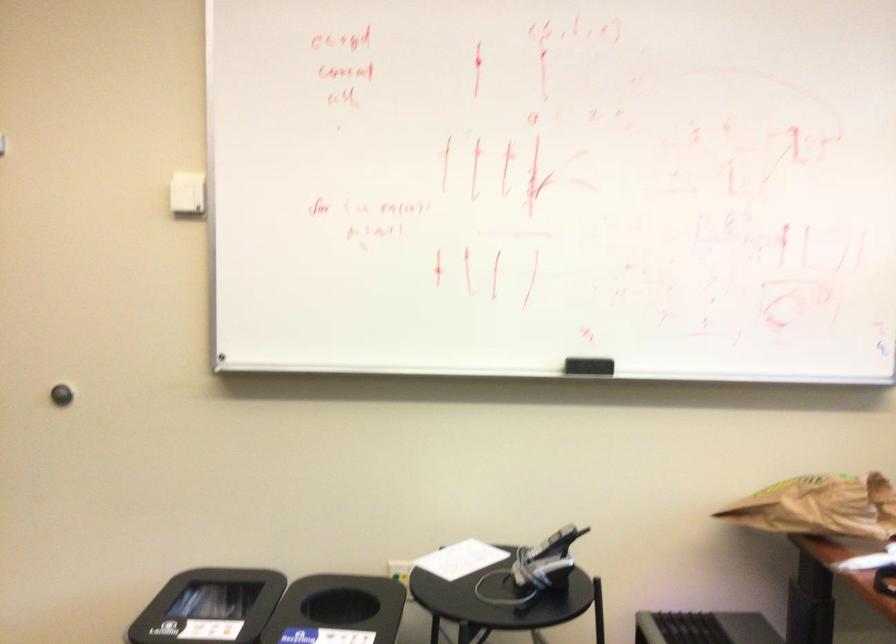
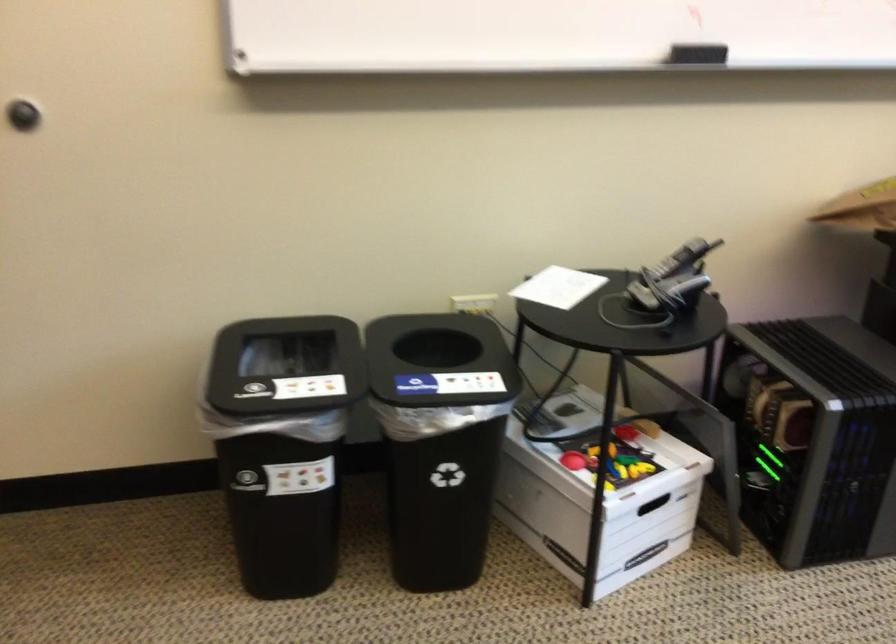
In the second image, find the point that corresponds to point 587,366 in the first image.

(696, 53)